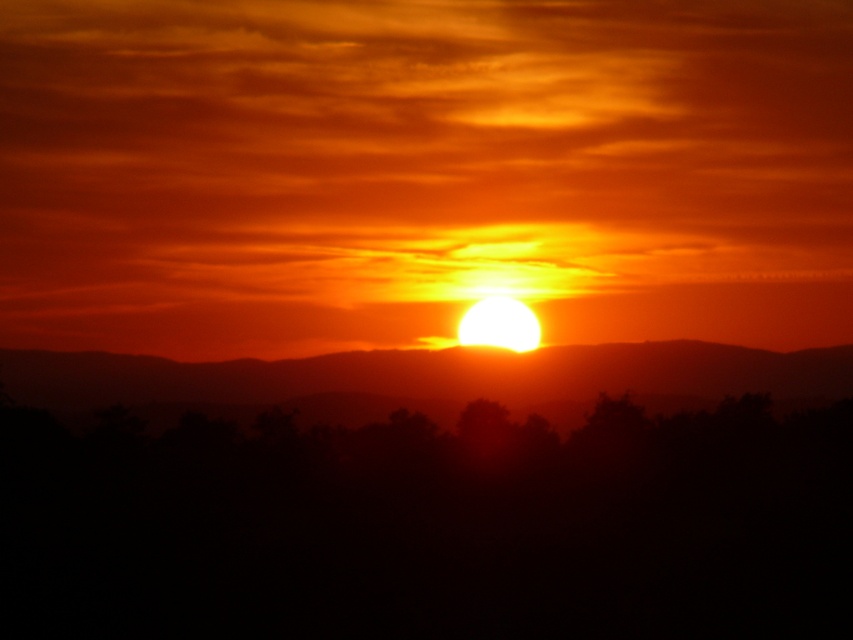
You are standing in the sunset scene and want to walk from the point at coordinates point (700, 476) to the point at coordinates point (352, 406). Can you see the latter point from your current position?

Point point (700, 476) is in front of point point (352, 406), so yes, you can see the point at point (352, 406) from your current position at point point (700, 476) because it is behind it and not obstructed.